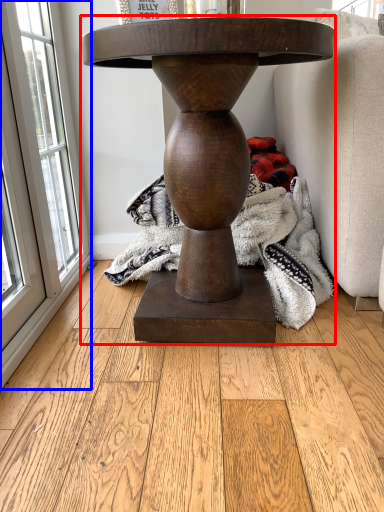
Question: Which object appears farthest to the camera in this image, table (highlighted by a red box) or window (highlighted by a blue box)?

Choices:
 (A) table
 (B) window

Answer: (B)